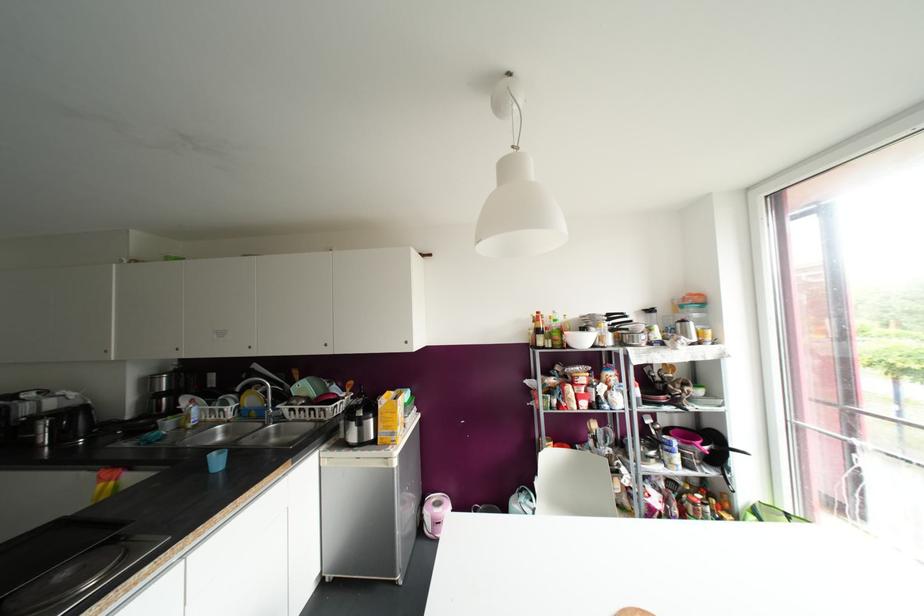
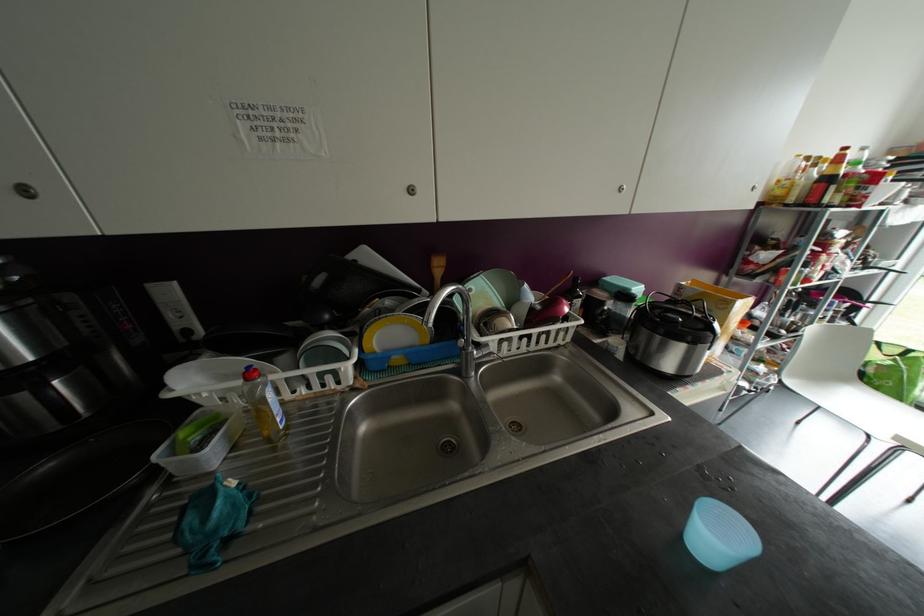
Where in the second image is the point corresponding to the point at 195,426 from the first image?

(286, 427)